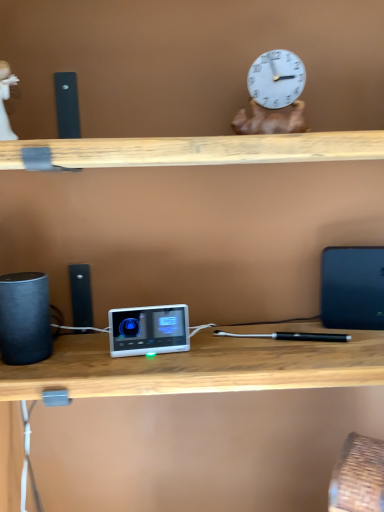
Question: Considering the positions of white porcelain figurine at upper left and blue matte laptop at right in the image, is white porcelain figurine at upper left bigger or smaller than blue matte laptop at right?

Choices:
 (A) big
 (B) small

Answer: (B)

Question: From a real-world perspective, is white porcelain figurine at upper left physically located above or below blue matte laptop at right?

Choices:
 (A) below
 (B) above

Answer: (B)

Question: Which object is the closest to the white porcelain figurine at upper left?

Choices:
 (A) black matte speaker at left
 (B) blue matte laptop at right
 (C) white plastic ipod at center

Answer: (A)

Question: Estimate the real-world distances between objects in this image. Which object is farther from the black matte speaker at left?

Choices:
 (A) white plastic ipod at center
 (B) white porcelain figurine at upper left
 (C) blue matte laptop at right

Answer: (C)